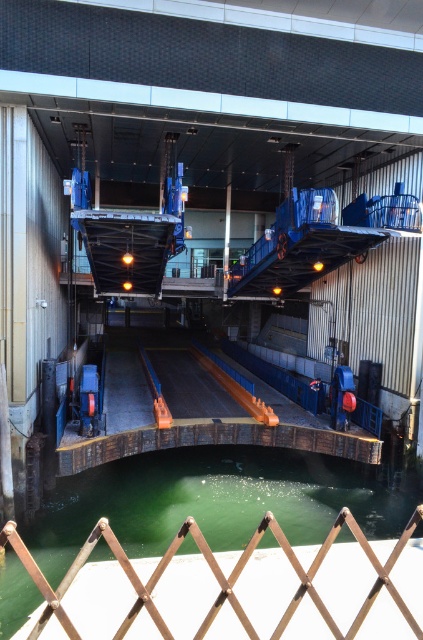
Looking at this image, between wooden dock at center and brown wooden fence at lower center, which one has less height?

brown wooden fence at lower center

Measure the distance between wooden dock at center and brown wooden fence at lower center.

The distance of wooden dock at center from brown wooden fence at lower center is 14.77 meters.

This screenshot has height=640, width=423. Describe the element at coordinates (197, 410) in the screenshot. I see `wooden dock at center` at that location.

Image resolution: width=423 pixels, height=640 pixels. Identify the location of wooden dock at center. (197, 410).